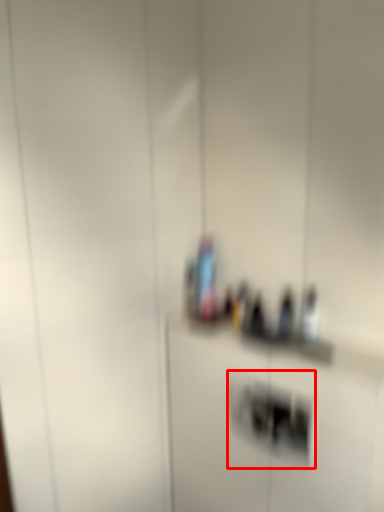
Question: Considering the relative positions of light switch (annotated by the red box) and bottle in the image provided, where is light switch (annotated by the red box) located with respect to the staircase?

Choices:
 (A) right
 (B) left

Answer: (A)